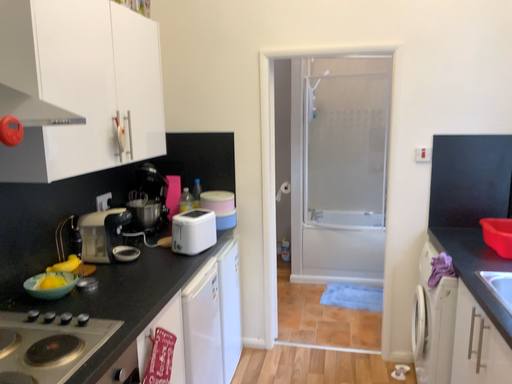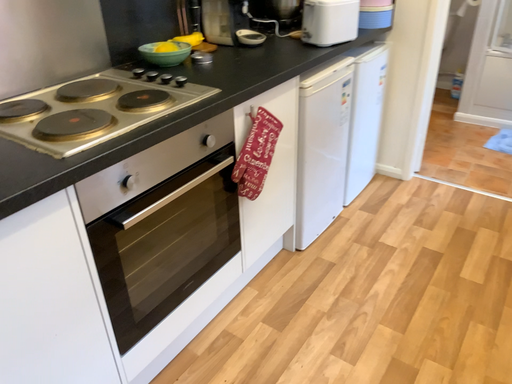
Question: Which way did the camera rotate in the video?

Choices:
 (A) rotated downward
 (B) rotated upward

Answer: (A)